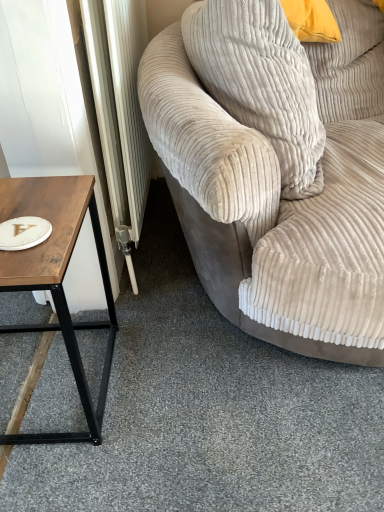
This screenshot has height=512, width=384. Identify the location of free space behind white matte paper plate at left. (40, 199).